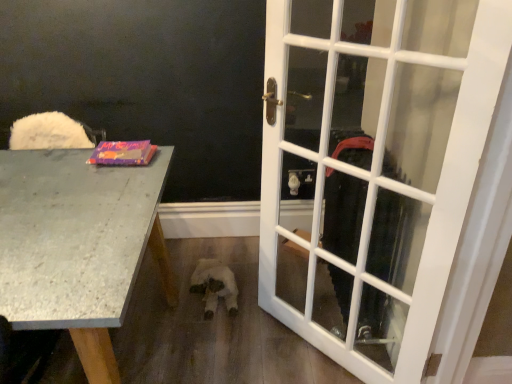
Image resolution: width=512 pixels, height=384 pixels. What do you see at coordinates (214, 286) in the screenshot? I see `white plush toy at center` at bounding box center [214, 286].

What do you see at coordinates (78, 245) in the screenshot?
I see `granite gray desk at left` at bounding box center [78, 245].

The width and height of the screenshot is (512, 384). Describe the element at coordinates (123, 153) in the screenshot. I see `matte purple book at left` at that location.

At what (x,y) coordinates should I click in order to perform the action: click on white glass door at right. Please return your answer as a coordinate pair (x, y). Looking at the image, I should click on (387, 178).

Is white plush toy at center positioned with its back to granite gray desk at left?

No, white plush toy at center's orientation is not away from granite gray desk at left.

Can you confirm if white plush toy at center is wider than granite gray desk at left?

No, white plush toy at center is not wider than granite gray desk at left.

From the image's perspective, between white plush toy at center and granite gray desk at left, which one is located above?

granite gray desk at left, from the image's perspective.

Consider the image. Who is more distant, white plush toy at center or granite gray desk at left?

Positioned behind is white plush toy at center.

Can you confirm if matte purple book at left is thinner than granite gray desk at left?

Yes, matte purple book at left is thinner than granite gray desk at left.

From the image's perspective, who appears lower, matte purple book at left or granite gray desk at left?

granite gray desk at left.

Which point is more forward, [138,163] or [68,162]?

Positioned in front is point [138,163].

From a real-world perspective, is matte purple book at left above or below white glass door at right?

matte purple book at left is above white glass door at right.

Is matte purple book at left far away from white glass door at right?

That's not correct — matte purple book at left is a little close to white glass door at right.

Relative to white glass door at right, is matte purple book at left in front or behind?

matte purple book at left is behind white glass door at right.

Looking at the image, does granite gray desk at left seem bigger or smaller compared to white plush toy at center?

Clearly, granite gray desk at left is larger in size than white plush toy at center.

Is point (158, 255) farther from camera compared to point (212, 316)?

Yes, it is.

Is granite gray desk at left not within white plush toy at center?

That's correct, granite gray desk at left is outside of white plush toy at center.

Is granite gray desk at left taller than white plush toy at center?

Yes.

Would you say granite gray desk at left is outside matte purple book at left?

Absolutely, granite gray desk at left is external to matte purple book at left.

At what (x,y) coordinates should I click in order to perform the action: click on desk on the left of the matte purple book at left. Please return your answer as a coordinate pair (x, y). Looking at the image, I should click on (78, 245).

From a real-world perspective, does granite gray desk at left stand above matte purple book at left?

No, from a real-world perspective, granite gray desk at left is not over matte purple book at left

In terms of width, does white glass door at right look wider or thinner when compared to white plush toy at center?

Clearly, white glass door at right has less width compared to white plush toy at center.

Does point (428, 331) come behind point (230, 275)?

No.

Can you confirm if white glass door at right is shorter than white plush toy at center?

In fact, white glass door at right may be taller than white plush toy at center.

This screenshot has width=512, height=384. In order to click on book in front of the white plush toy at center in this screenshot , I will do `click(123, 153)`.

Based on the photo, is matte purple book at left touching white plush toy at center?

No, matte purple book at left is not in contact with white plush toy at center.

Which of these two, matte purple book at left or white plush toy at center, is thinner?

matte purple book at left.

Which of these two, matte purple book at left or white plush toy at center, stands shorter?

Standing shorter between the two is matte purple book at left.

Identify the location of animal that appears below the granite gray desk at left (from a real-world perspective). The width and height of the screenshot is (512, 384). (214, 286).

This screenshot has height=384, width=512. I want to click on desk on the left of matte purple book at left, so click(x=78, y=245).

Considering their positions, is white plush toy at center positioned closer to white glass door at right than granite gray desk at left?

white plush toy at center is closer to white glass door at right.

Which object lies nearer to the anchor point matte purple book at left, granite gray desk at left or white glass door at right?

Based on the image, granite gray desk at left appears to be nearer to matte purple book at left.

Which object lies nearer to the anchor point white plush toy at center, matte purple book at left or granite gray desk at left?

matte purple book at left.

Estimate the real-world distances between objects in this image. Which object is further from white plush toy at center, granite gray desk at left or matte purple book at left?

granite gray desk at left is positioned further to the anchor white plush toy at center.

Which object lies nearer to the anchor point white glass door at right, white plush toy at center or matte purple book at left?

white plush toy at center lies closer to white glass door at right than the other object.

Looking at the image, which one is located further to white plush toy at center, white glass door at right or matte purple book at left?

Among the two, matte purple book at left is located further to white plush toy at center.

Estimate the real-world distances between objects in this image. Which object is further from granite gray desk at left, white glass door at right or matte purple book at left?

white glass door at right is further to granite gray desk at left.

Based on their spatial positions, is white glass door at right or granite gray desk at left closer to white plush toy at center?

The object closer to white plush toy at center is white glass door at right.

What are the coordinates of `book situated between granite gray desk at left and white glass door at right from left to right` in the screenshot? It's located at (123, 153).

Where is `book between granite gray desk at left and white plush toy at center in the front-back direction`? The height and width of the screenshot is (384, 512). book between granite gray desk at left and white plush toy at center in the front-back direction is located at coordinates (123, 153).

I want to click on book between white glass door at right and white plush toy at center from front to back, so click(x=123, y=153).

At what (x,y) coordinates should I click in order to perform the action: click on door located between granite gray desk at left and white plush toy at center in the depth direction. Please return your answer as a coordinate pair (x, y). The width and height of the screenshot is (512, 384). Looking at the image, I should click on (387, 178).